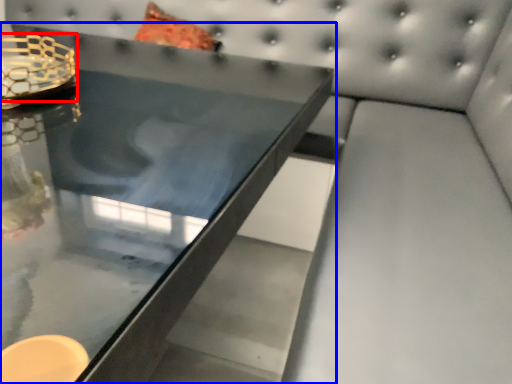
Question: Which object is further to the camera taking this photo, candle holder (highlighted by a red box) or table (highlighted by a blue box)?

Choices:
 (A) candle holder
 (B) table

Answer: (A)